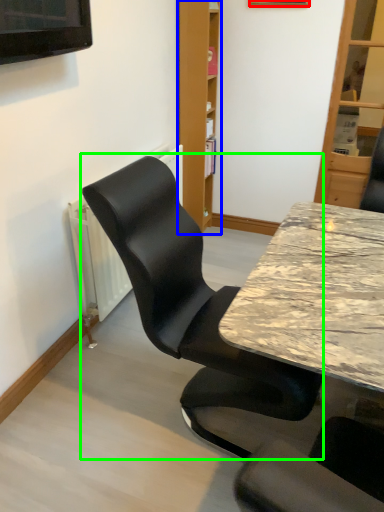
Question: Which is nearer to the picture frame (highlighted by a red box)? bookshelf (highlighted by a blue box) or chair (highlighted by a green box).

Choices:
 (A) bookshelf
 (B) chair

Answer: (A)